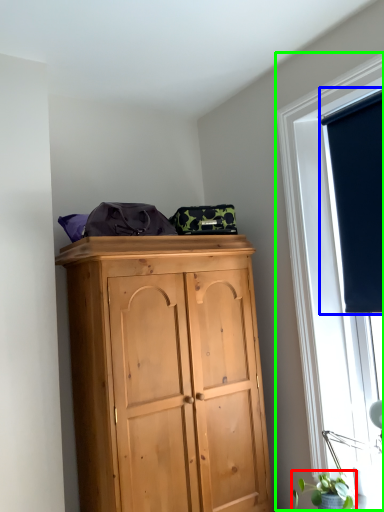
Question: Which object is positioned farthest from plant (highlighted by a red box)? Select from window screen (highlighted by a blue box) and window (highlighted by a green box).

Choices:
 (A) window screen
 (B) window

Answer: (A)